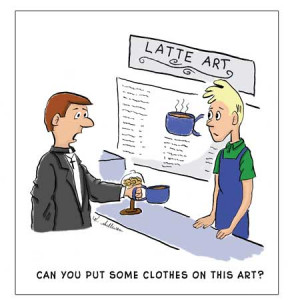
Identify the location of art. This screenshot has height=300, width=300. (215, 63).